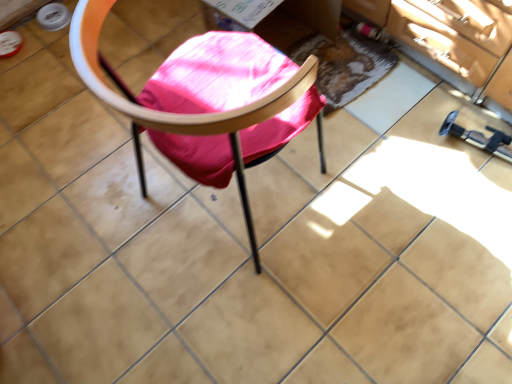
Question: Looking at their shapes, would you say wooden chair at center is wider or thinner than textured woolen mat at center?

Choices:
 (A) wide
 (B) thin

Answer: (A)

Question: From the image's perspective, is wooden chair at center above or below textured woolen mat at center?

Choices:
 (A) below
 (B) above

Answer: (A)

Question: Is wooden chair at center to the left or to the right of textured woolen mat at center in the image?

Choices:
 (A) right
 (B) left

Answer: (B)

Question: Is point coord(346,33) closer or farther from the camera than point coord(244,201)?

Choices:
 (A) closer
 (B) farther

Answer: (B)

Question: Is textured woolen mat at center wider or thinner than wooden chair at center?

Choices:
 (A) wide
 (B) thin

Answer: (B)

Question: Based on their positions, is textured woolen mat at center located to the left or right of wooden chair at center?

Choices:
 (A) left
 (B) right

Answer: (B)

Question: Considering their positions, is textured woolen mat at center located in front of or behind wooden chair at center?

Choices:
 (A) front
 (B) behind

Answer: (B)